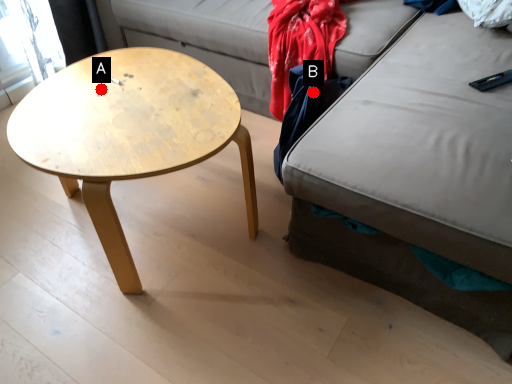
Question: Two points are circled on the image, labeled by A and B beside each circle. Which point is closer to the camera taking this photo?

Choices:
 (A) A is closer
 (B) B is closer

Answer: (A)